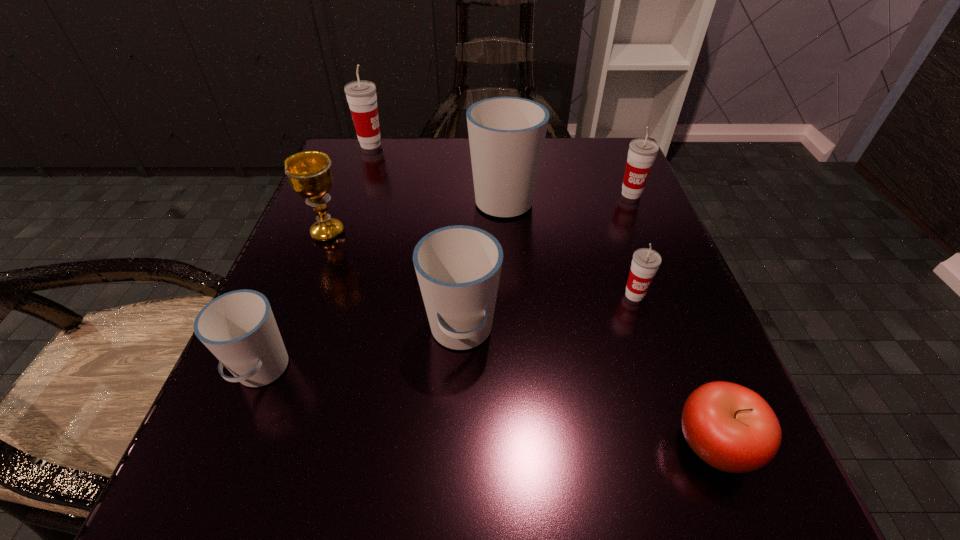
Image resolution: width=960 pixels, height=540 pixels. In order to click on object located in the near edge section of the desktop in this screenshot , I will do `click(733, 429)`.

Where is `chalice present at the left edge`? The width and height of the screenshot is (960, 540). chalice present at the left edge is located at coordinates (309, 172).

I want to click on apple present at the right edge, so click(x=733, y=429).

In order to click on object present at the far left corner in this screenshot , I will do `click(361, 96)`.

This screenshot has width=960, height=540. What are the coordinates of `object present at the far right corner` in the screenshot? It's located at (642, 152).

Image resolution: width=960 pixels, height=540 pixels. In order to click on object at the near right corner in this screenshot , I will do `click(733, 429)`.

The image size is (960, 540). In the image, there is a desktop. Identify the location of blank space at the far edge. pos(420,145).

Identify the location of free space at the near edge. The width and height of the screenshot is (960, 540). (551, 530).

In the image, there is a desktop. Where is `vacant space at the left edge`? The height and width of the screenshot is (540, 960). vacant space at the left edge is located at coordinates (383, 249).

Identify the location of free space at the right edge of the desktop. The image size is (960, 540). 637,235.